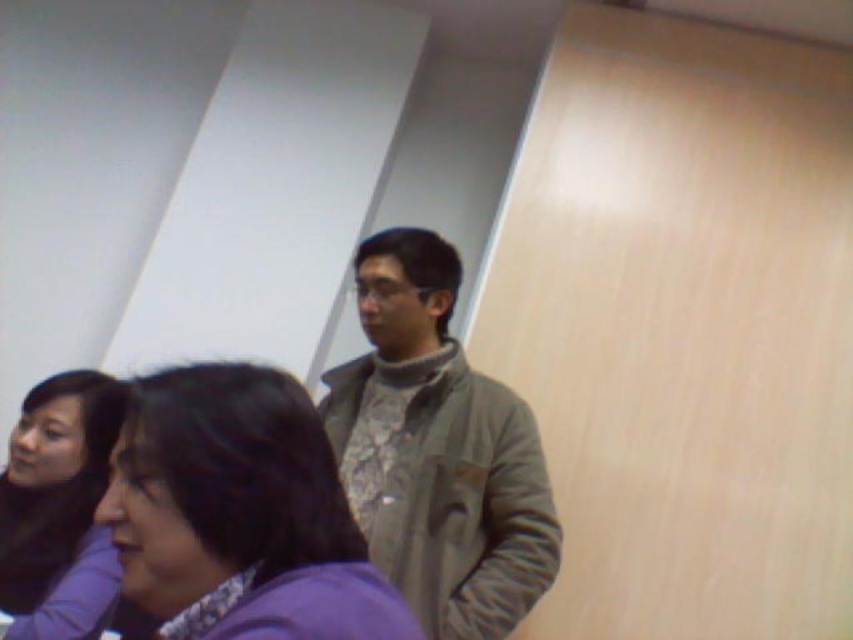
Which is behind, point (403, 269) or point (112, 396)?

The point (403, 269) is more distant.

Who is positioned more to the right, gray fabric jacket at center or matte black hair at upper left?

gray fabric jacket at center

Identify the location of gray fabric jacket at center. This screenshot has width=853, height=640. (438, 451).

Can you confirm if gray fabric jacket at center is taller than purple fabric at center?

Yes.

Is point (409, 422) positioned after point (137, 445)?

That is True.

Locate an element on the screen. gray fabric jacket at center is located at coordinates (438, 451).

Between point (271, 428) and point (106, 612), which one is positioned in front?

Point (271, 428) is more forward.

Which of these two, purple fabric at center or matte black hair at upper left, stands taller?

matte black hair at upper left

Is point (303, 534) farther from viewer compared to point (105, 468)?

No, it is not.

Identify the location of purple fabric at center. The width and height of the screenshot is (853, 640). (241, 508).